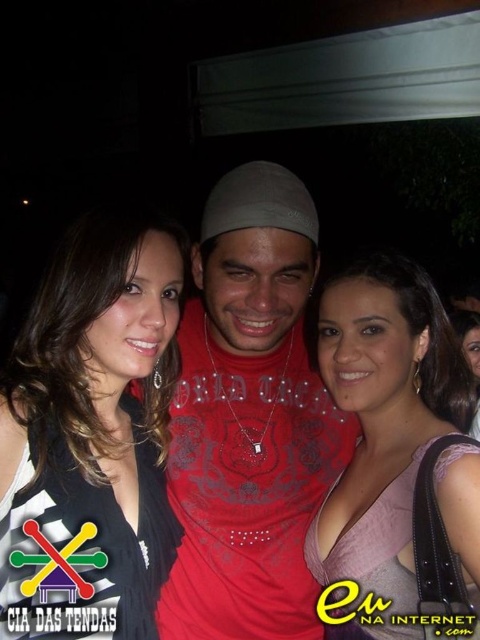
Question: Which object is farther from the camera taking this photo?

Choices:
 (A) black textured dress at center
 (B) matte pink dress at center

Answer: (B)

Question: Among these points, which one is nearest to the camera?

Choices:
 (A) (468, 340)
 (B) (204, 356)
 (C) (168, 401)
 (D) (382, 474)

Answer: (D)

Question: Is black textured dress at center below pink satin dress at center?

Choices:
 (A) no
 (B) yes

Answer: (A)

Question: Which object appears closest to the camera in this image?

Choices:
 (A) matte pink dress at center
 (B) pink satin dress at center
 (C) matte red t-shirt at center
 (D) black textured dress at center

Answer: (D)

Question: From the image, what is the correct spatial relationship of pink satin dress at center in relation to matte pink dress at center?

Choices:
 (A) right
 (B) left

Answer: (B)

Question: Does pink satin dress at center appear over matte pink dress at center?

Choices:
 (A) yes
 (B) no

Answer: (B)